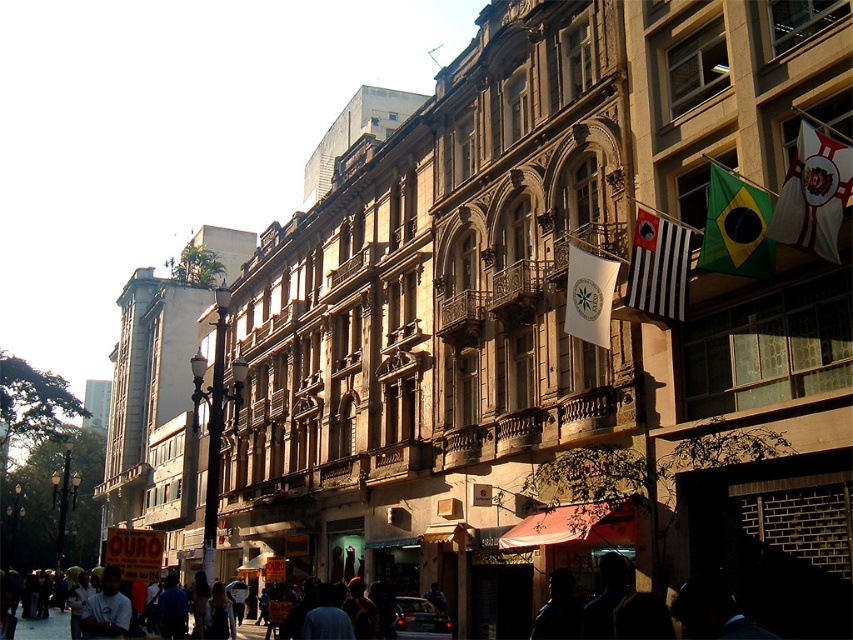
You are standing on the sidewalk in the bustling urban street scene. You notice two figures in the center of the image. One is labeled as the silhouette figure at center, and the other is the silhouette of person at center. Which of these two figures is positioned higher up in the image?

The silhouette figure at center is positioned higher up in the image compared to the silhouette of person at center.

You are a photographer standing on the street and want to capture a clear photo of the light blue shirt at lower left without the dark gray fabric crowd at center blocking it. How should you adjust your position?

Move closer to the light blue shirt at lower left. Since the light blue shirt at lower left is in front of the dark gray fabric crowd at center, moving closer will reduce the crowd appearing behind it in the photo.

Looking at this image, you are a photographer trying to capture a clear shot of the silhouette figure at center without the dark gray fabric crowd at center blocking the view. Is this possible given their current positions?

The silhouette figure at center occupies less space than the dark gray fabric crowd at center, so it may be challenging to capture a clear shot without the crowd blocking the view.